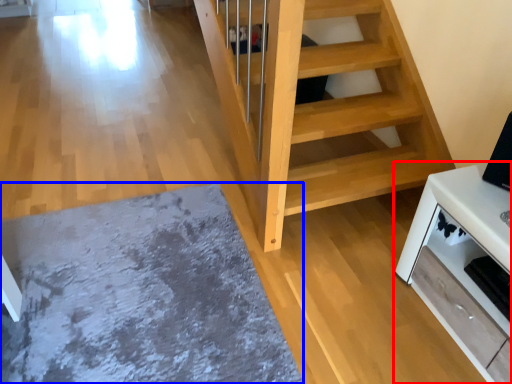
Question: Which object is further to the camera taking this photo, furniture (highlighted by a red box) or mat (highlighted by a blue box)?

Choices:
 (A) furniture
 (B) mat

Answer: (B)